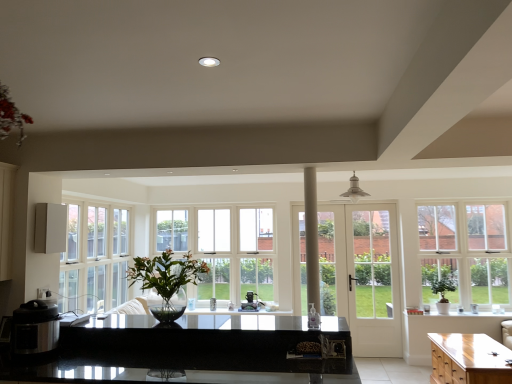
Question: Based on their sizes in the image, would you say white glass window at right, placed as the second window when sorted from back to front, is bigger or smaller than green leafy plant at right, placed as the second houseplant when sorted from front to back?

Choices:
 (A) big
 (B) small

Answer: (A)

Question: Is white glass window at right, which is the 1th window in front-to-back order, inside or outside of green leafy plant at right, arranged as the 1th houseplant when viewed from the right?

Choices:
 (A) inside
 (B) outside

Answer: (B)

Question: Which is nearer to the light brown wooden cabinet at lower right?

Choices:
 (A) satin black coffee maker at center, which is the 1th appliance in right-to-left order
 (B) white glass window at right, placed as the second window when sorted from back to front
 (C) white wood window at center, placed as the first window when sorted from back to front
 (D) translucent glass vase at center, which is the 1th houseplant in top-to-bottom order
 (E) white glass door at center

Answer: (B)

Question: Which object is the closest to the translucent glass vase at center, which appears as the 2th houseplant when viewed from the right?

Choices:
 (A) white wood window at center, placed as the first window when sorted from back to front
 (B) white glass window at right, placed as the second window when sorted from back to front
 (C) satin black coffee maker at center, which is the 1th appliance from bottom to top
 (D) white glossy speaker at left, arranged as the third appliance when ordered from the bottom
 (E) black granite countertop at center

Answer: (E)